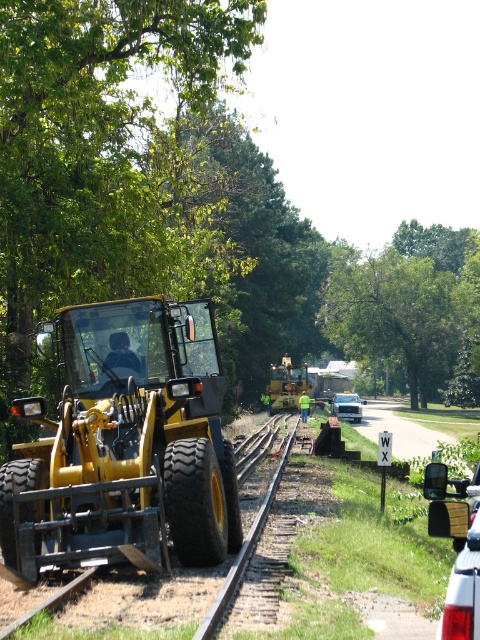
Is glossy plastic mirror at lower right taller than metallic silver sedan at center?

In fact, glossy plastic mirror at lower right may be shorter than metallic silver sedan at center.

Looking at this image, does glossy plastic mirror at lower right have a lesser height compared to metallic silver sedan at center?

Yes, glossy plastic mirror at lower right is shorter than metallic silver sedan at center.

Measure the distance between point (x=424, y=474) and camera.

12.32 feet

Locate an element on the screen. glossy plastic mirror at lower right is located at coordinates (457, 554).

Does glossy plastic mirror at lower right appear over yellow rubber tractor at center?

Correct, glossy plastic mirror at lower right is located above yellow rubber tractor at center.

Who is more distant from viewer, (456, 481) or (285, 406)?

Positioned behind is point (285, 406).

I want to click on glossy plastic mirror at lower right, so click(x=457, y=554).

I want to click on glossy plastic mirror at lower right, so click(457, 554).

Is green leafy tree at left below metallic silver sedan at center?

No, green leafy tree at left is not below metallic silver sedan at center.

Can you confirm if green leafy tree at left is positioned above metallic silver sedan at center?

Correct, green leafy tree at left is located above metallic silver sedan at center.

Between point (156, 262) and point (337, 404), which one is positioned in front?

Positioned in front is point (156, 262).

Locate an element on the screen. green leafy tree at left is located at coordinates (107, 163).